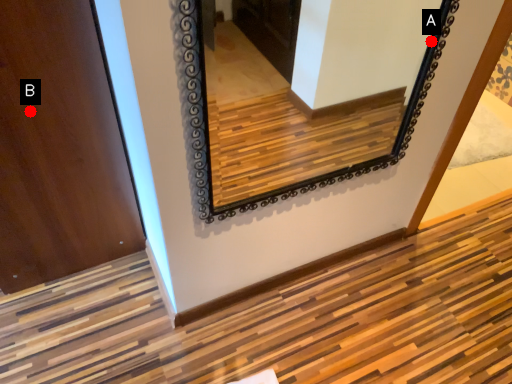
Question: Two points are circled on the image, labeled by A and B beside each circle. Among these points, which one is farthest from the camera?

Choices:
 (A) A is further
 (B) B is further

Answer: (B)